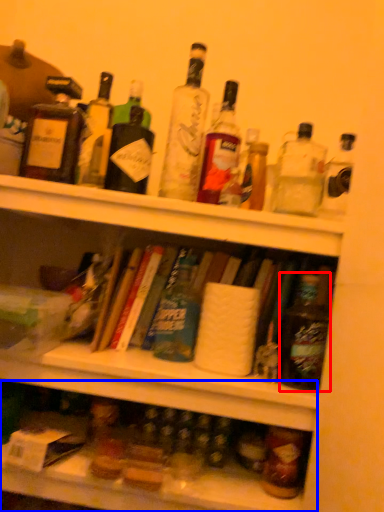
Question: Which of the following is the closest to the observer, bottle (highlighted by a red box) or shelf (highlighted by a blue box)?

Choices:
 (A) bottle
 (B) shelf

Answer: (B)